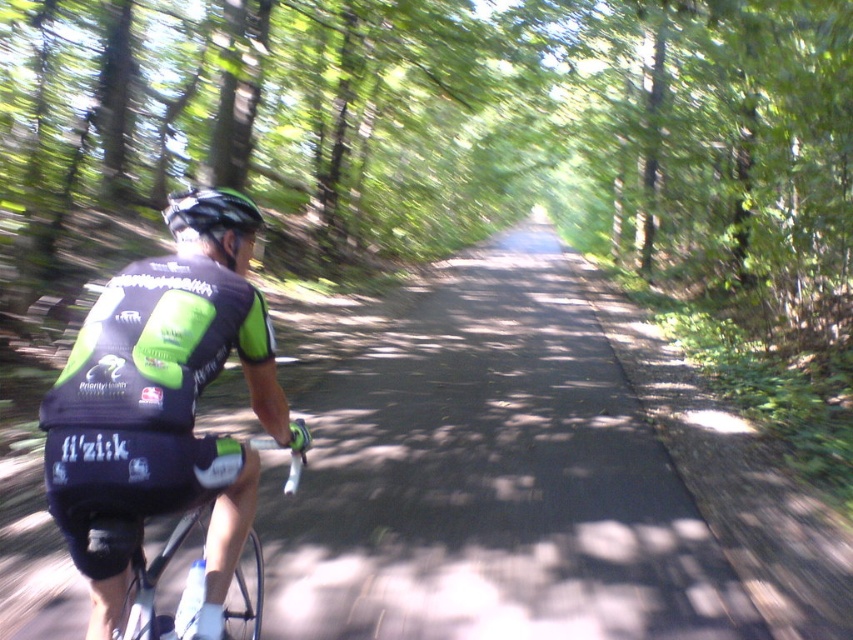
Between black matte cycling jersey at left and matte black helmet at center, which one appears on the left side from the viewer's perspective?

From the viewer's perspective, matte black helmet at center appears more on the left side.

Which of these two, black matte cycling jersey at left or matte black helmet at center, stands shorter?

With less height is black matte cycling jersey at left.

Measure the distance between black matte cycling jersey at left and camera.

black matte cycling jersey at left is 5.92 feet away from camera.

Identify the location of black matte cycling jersey at left. (151, 577).